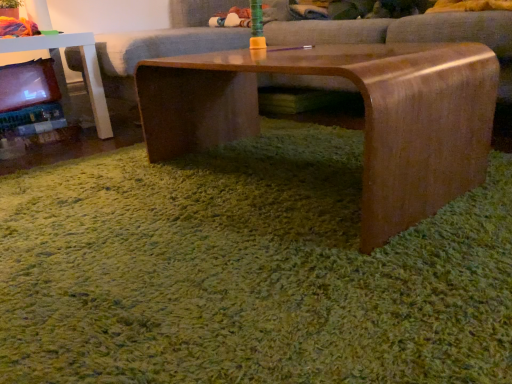
This screenshot has height=384, width=512. I want to click on green shaggy carpet at center, so click(x=247, y=272).

Measure the distance between green shaggy carpet at center and camera.

A distance of 52.14 centimeters exists between green shaggy carpet at center and camera.

This screenshot has width=512, height=384. What are the coordinates of `matte plastic toy at left` in the screenshot? It's located at (83, 66).

Measure the distance between shiny brown wood coffee table at center and camera.

The distance of shiny brown wood coffee table at center from camera is 28.30 inches.

Find the location of `green shaggy carpet at center`. green shaggy carpet at center is located at coordinates (247, 272).

Which is more to the right, matte plastic toy at left or matte brown couch at center?

matte brown couch at center.

Considering the sizes of objects matte plastic toy at left and matte brown couch at center in the image provided, who is shorter, matte plastic toy at left or matte brown couch at center?

Standing shorter between the two is matte plastic toy at left.

The height and width of the screenshot is (384, 512). In order to click on table below the matte brown couch at center (from the image's perspective) in this screenshot , I will do `click(83, 66)`.

From the image's perspective, which is below, matte plastic toy at left or matte brown couch at center?

matte plastic toy at left is shown below in the image.

Based on the photo, between shiny brown wood coffee table at center and green shaggy carpet at center, which one has more height?

With more height is shiny brown wood coffee table at center.

From the picture: From a real-world perspective, which is physically above, shiny brown wood coffee table at center or green shaggy carpet at center?

In real-world perspective, shiny brown wood coffee table at center is above.

Are shiny brown wood coffee table at center and green shaggy carpet at center far apart?

No, shiny brown wood coffee table at center is not far away from green shaggy carpet at center.

Is shiny brown wood coffee table at center positioned beyond the bounds of green shaggy carpet at center?

Yes, shiny brown wood coffee table at center is located beyond the bounds of green shaggy carpet at center.

Looking at this image, is matte brown couch at center with matte plastic toy at left?

They are not placed beside each other.

Is matte brown couch at center bigger than matte plastic toy at left?

Correct, matte brown couch at center is larger in size than matte plastic toy at left.

Can you confirm if matte brown couch at center is positioned to the right of matte plastic toy at left?

Yes.

Is matte brown couch at center not within matte plastic toy at left?

Indeed, matte brown couch at center is completely outside matte plastic toy at left.

Based on their positions, is matte brown couch at center located to the left or right of green shaggy carpet at center?

In the image, matte brown couch at center appears on the left side of green shaggy carpet at center.

Considering the positions of points (219, 31) and (422, 322), is point (219, 31) closer to camera compared to point (422, 322)?

No, (219, 31) is further to viewer.

Is matte brown couch at center far from green shaggy carpet at center?

No.

Considering the sizes of matte brown couch at center and green shaggy carpet at center in the image, is matte brown couch at center taller or shorter than green shaggy carpet at center?

Clearly, matte brown couch at center is taller compared to green shaggy carpet at center.

Is the depth of shiny brown wood coffee table at center greater than that of matte plastic toy at left?

No, shiny brown wood coffee table at center is in front of matte plastic toy at left.

Based on the photo, from the image's perspective, is shiny brown wood coffee table at center below matte plastic toy at left?

Correct, shiny brown wood coffee table at center appears lower than matte plastic toy at left in the image.

Can you tell me how much shiny brown wood coffee table at center and matte plastic toy at left differ in facing direction?

There is a 90.4-degree angle between the facing directions of shiny brown wood coffee table at center and matte plastic toy at left.

Is shiny brown wood coffee table at center spatially inside matte plastic toy at left, or outside of it?

shiny brown wood coffee table at center lies outside matte plastic toy at left.

The height and width of the screenshot is (384, 512). What are the coordinates of `table lying above the shiny brown wood coffee table at center (from the image's perspective)` in the screenshot? It's located at (83, 66).

Based on the photo, considering the relative sizes of matte plastic toy at left and shiny brown wood coffee table at center in the image provided, is matte plastic toy at left taller than shiny brown wood coffee table at center?

Yes.

How different are the orientations of matte plastic toy at left and shiny brown wood coffee table at center in degrees?

There is a 90.4-degree angle between the facing directions of matte plastic toy at left and shiny brown wood coffee table at center.

In the scene shown: Does matte plastic toy at left appear on the right side of shiny brown wood coffee table at center?

In fact, matte plastic toy at left is to the left of shiny brown wood coffee table at center.

From a real-world perspective, is shiny brown wood coffee table at center on matte brown couch at center?

No, from a real-world perspective, shiny brown wood coffee table at center is not above matte brown couch at center.

Between shiny brown wood coffee table at center and matte brown couch at center, which one appears on the right side from the viewer's perspective?

shiny brown wood coffee table at center.

From the image's perspective, is shiny brown wood coffee table at center on top of matte brown couch at center?

No, from the image's perspective, shiny brown wood coffee table at center is not above matte brown couch at center.

Is shiny brown wood coffee table at center surrounding matte brown couch at center?

That's incorrect, matte brown couch at center is not inside shiny brown wood coffee table at center.

What are the coordinates of `table in front of the matte brown couch at center` in the screenshot? It's located at (83, 66).

In the image, there is a shiny brown wood coffee table at center. Where is `grass below it (from the image's perspective)`? The height and width of the screenshot is (384, 512). grass below it (from the image's perspective) is located at coordinates (247, 272).

Considering their positions, is shiny brown wood coffee table at center positioned further to matte plastic toy at left than matte brown couch at center?

Based on the image, shiny brown wood coffee table at center appears to be further to matte plastic toy at left.

Which object lies nearer to the anchor point matte plastic toy at left, matte brown couch at center or green shaggy carpet at center?

matte brown couch at center lies closer to matte plastic toy at left than the other object.

When comparing their distances from shiny brown wood coffee table at center, does matte plastic toy at left or matte brown couch at center seem closer?

matte brown couch at center lies closer to shiny brown wood coffee table at center than the other object.

Estimate the real-world distances between objects in this image. Which object is closer to green shaggy carpet at center, matte brown couch at center or matte plastic toy at left?

matte brown couch at center is closer to green shaggy carpet at center.

From the image, which object appears to be nearer to green shaggy carpet at center, matte brown couch at center or shiny brown wood coffee table at center?

shiny brown wood coffee table at center is closer to green shaggy carpet at center.

Looking at the image, which one is located further to matte plastic toy at left, matte brown couch at center or shiny brown wood coffee table at center?

Based on the image, shiny brown wood coffee table at center appears to be further to matte plastic toy at left.

When comparing their distances from green shaggy carpet at center, does shiny brown wood coffee table at center or matte plastic toy at left seem closer?

Based on the image, shiny brown wood coffee table at center appears to be nearer to green shaggy carpet at center.

When comparing their distances from matte brown couch at center, does matte plastic toy at left or green shaggy carpet at center seem further?

green shaggy carpet at center is further to matte brown couch at center.

Locate an element on the screen. The height and width of the screenshot is (384, 512). coffee table between green shaggy carpet at center and matte plastic toy at left along the z-axis is located at coordinates (365, 116).

The height and width of the screenshot is (384, 512). I want to click on coffee table located between green shaggy carpet at center and matte brown couch at center in the depth direction, so click(x=365, y=116).

Where is `studio couch between matte plastic toy at left and shiny brown wood coffee table at center in the horizontal direction`? studio couch between matte plastic toy at left and shiny brown wood coffee table at center in the horizontal direction is located at coordinates (401, 30).

Locate an element on the screen. The height and width of the screenshot is (384, 512). table between green shaggy carpet at center and matte brown couch at center along the z-axis is located at coordinates (83, 66).